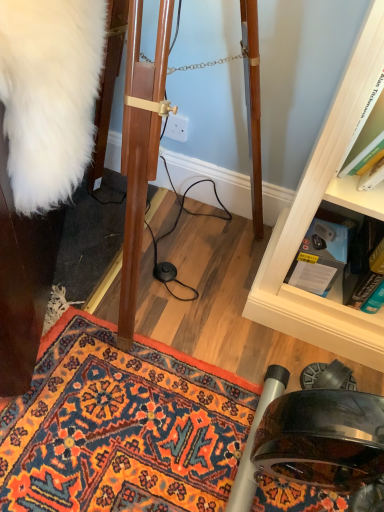
Question: Does carpeted doormat at lower left come behind white fluffy coat at left?

Choices:
 (A) yes
 (B) no

Answer: (A)

Question: Would you consider carpeted doormat at lower left to be distant from white fluffy coat at left?

Choices:
 (A) yes
 (B) no

Answer: (B)

Question: Is carpeted doormat at lower left facing towards white fluffy coat at left?

Choices:
 (A) no
 (B) yes

Answer: (A)

Question: Considering the relative sizes of carpeted doormat at lower left and white fluffy coat at left in the image provided, is carpeted doormat at lower left shorter than white fluffy coat at left?

Choices:
 (A) yes
 (B) no

Answer: (A)

Question: Can you confirm if carpeted doormat at lower left is bigger than white fluffy coat at left?

Choices:
 (A) no
 (B) yes

Answer: (A)

Question: Relative to white plastic power outlet at center, is hardcover book at lower right, which is the second book in left-to-right order, in front or behind?

Choices:
 (A) front
 (B) behind

Answer: (A)

Question: From the image's perspective, is hardcover book at lower right, the first book viewed from the right, positioned above or below white plastic power outlet at center?

Choices:
 (A) above
 (B) below

Answer: (B)

Question: Choose the correct answer: Is hardcover book at lower right, the first book viewed from the right, inside white plastic power outlet at center or outside it?

Choices:
 (A) inside
 (B) outside

Answer: (B)

Question: Considering the relative positions of hardcover book at lower right, which is the second book in left-to-right order, and white plastic power outlet at center in the image provided, is hardcover book at lower right, which is the second book in left-to-right order, to the left or to the right of white plastic power outlet at center?

Choices:
 (A) right
 (B) left

Answer: (A)

Question: Which is correct: white plastic power outlet at center is inside hardcover book at lower right, the first book viewed from the right, or outside of it?

Choices:
 (A) inside
 (B) outside

Answer: (B)

Question: Is white plastic power outlet at center to the left or to the right of hardcover book at lower right, the first book viewed from the right, in the image?

Choices:
 (A) left
 (B) right

Answer: (A)

Question: From a real-world perspective, is white plastic power outlet at center physically located above or below hardcover book at lower right, the first book viewed from the right?

Choices:
 (A) below
 (B) above

Answer: (B)

Question: In terms of size, does white plastic power outlet at center appear bigger or smaller than hardcover book at lower right, which is the second book in left-to-right order?

Choices:
 (A) big
 (B) small

Answer: (B)

Question: From a real-world perspective, is carpeted doormat at lower left positioned above or below white fluffy coat at left?

Choices:
 (A) below
 (B) above

Answer: (A)

Question: From the image's perspective, is carpeted doormat at lower left positioned above or below white fluffy coat at left?

Choices:
 (A) above
 (B) below

Answer: (B)